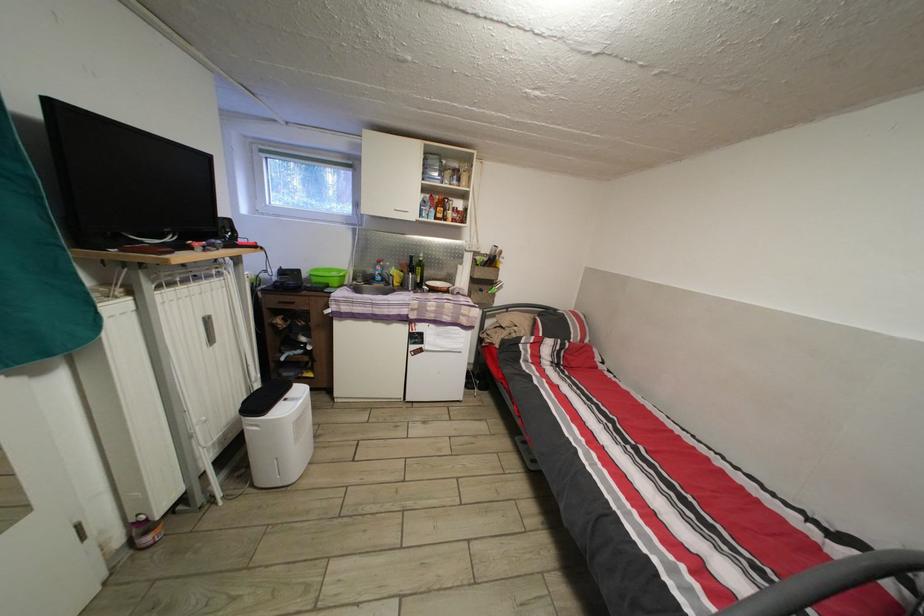
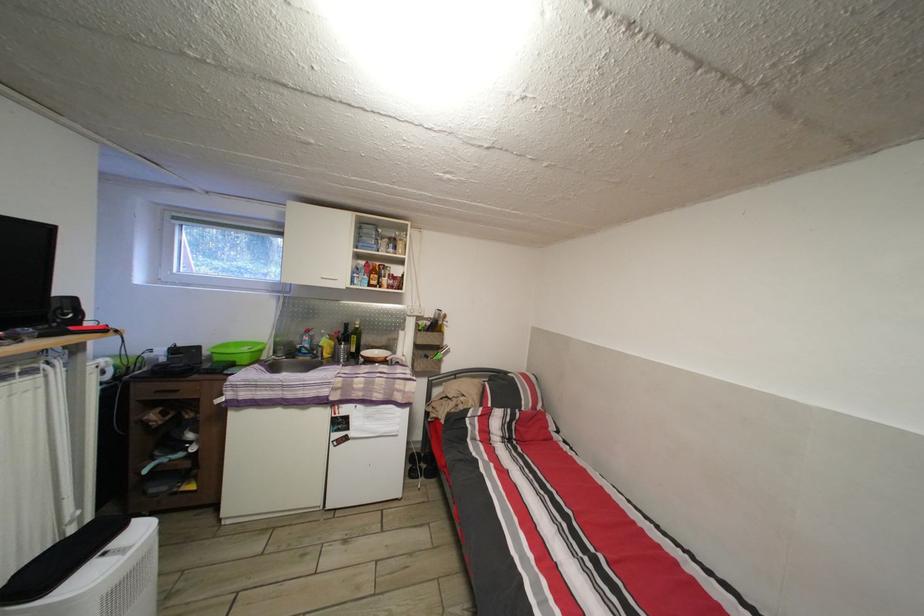
Where in the second image is the point corresponding to (398,285) from the first image?

(327, 355)